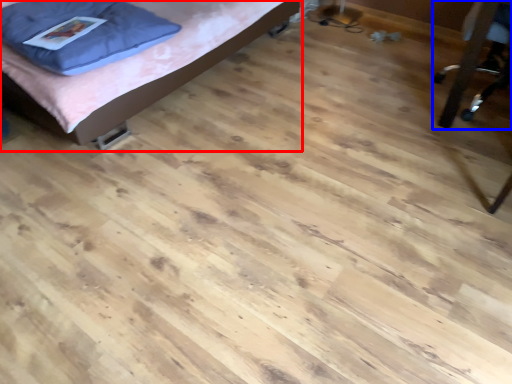
Question: Among these objects, which one is farthest to the camera, bed (highlighted by a red box) or furniture (highlighted by a blue box)?

Choices:
 (A) bed
 (B) furniture

Answer: (B)